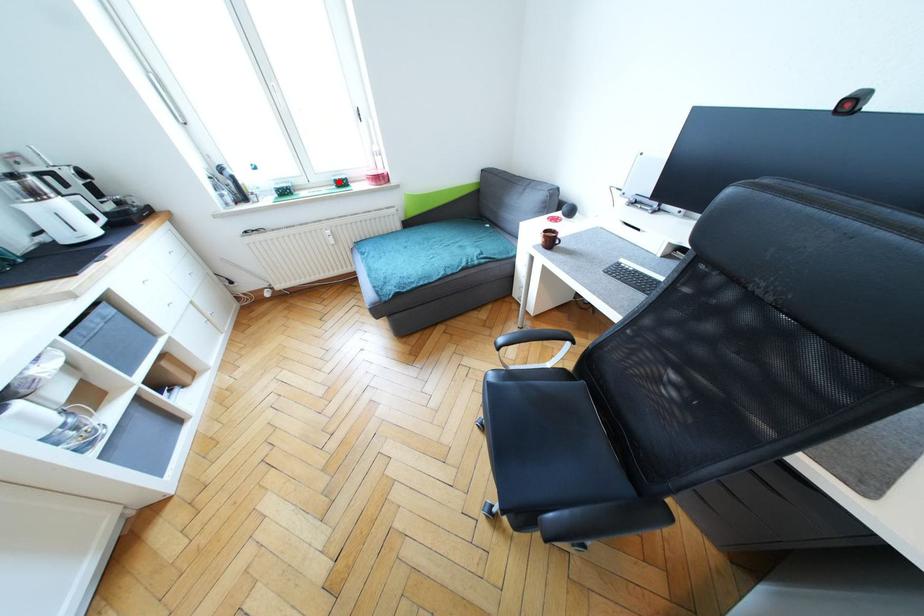
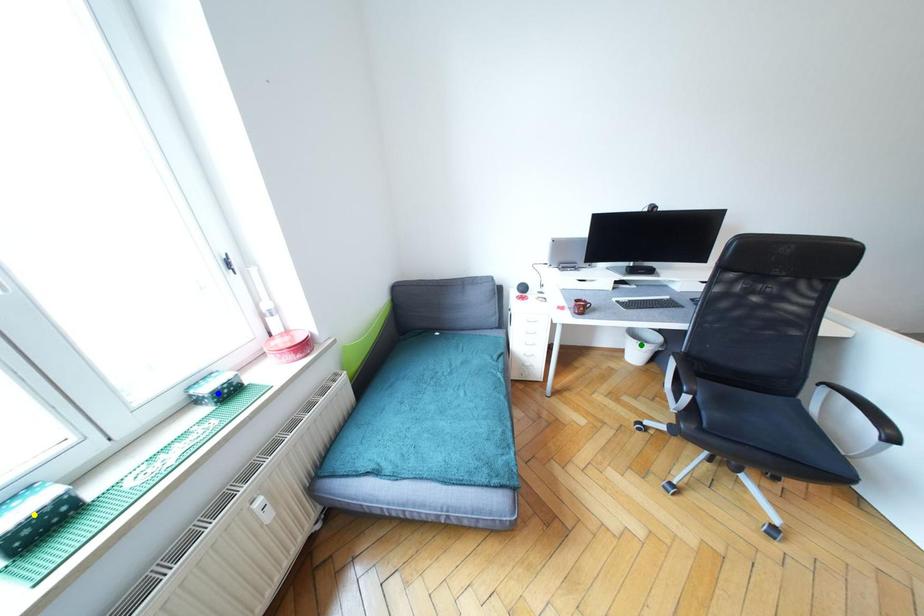
Question: I am providing you with two images of the same scene from different viewpoints. A red point is marked on the first image. You are given multiple points on the second image. Which point in image 2 is actually the same real-world point as the red point in image 1?

Choices:
 (A) blue point
 (B) yellow point
 (C) green point

Answer: (A)